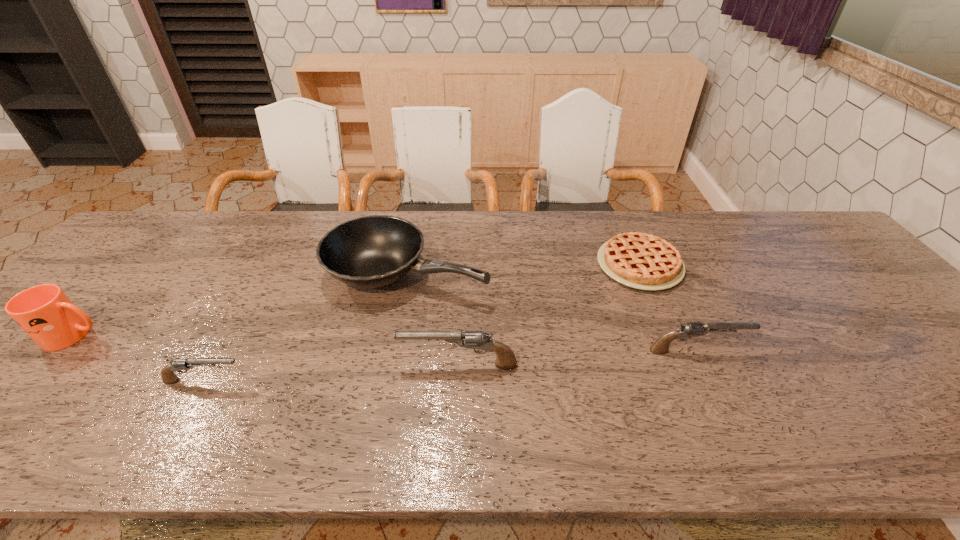
Where is `object at the left edge`? This screenshot has width=960, height=540. object at the left edge is located at coordinates (44, 312).

Where is `free region at the far edge of the desktop`? The height and width of the screenshot is (540, 960). free region at the far edge of the desktop is located at coordinates (195, 225).

Image resolution: width=960 pixels, height=540 pixels. In order to click on vacant position at the near edge of the desktop in this screenshot , I will do tap(311, 402).

I want to click on free space at the right edge of the desktop, so click(x=905, y=336).

Find the location of a particular element. This screenshot has height=540, width=960. vacant space at the far left corner of the desktop is located at coordinates (159, 238).

At what (x,y) coordinates should I click in order to perform the action: click on vacant position at the far right corner of the desktop. Please return your answer as a coordinate pair (x, y). This screenshot has height=540, width=960. Looking at the image, I should click on (782, 240).

What are the coordinates of `blank region between the leftmost gun and the pie` in the screenshot? It's located at (422, 323).

Locate an element on the screen. vacant area between the fifth tallest object and the tallest gun is located at coordinates (331, 373).

Image resolution: width=960 pixels, height=540 pixels. Identify the location of free space between the pie and the fifth object from right to left. [x=422, y=323].

Image resolution: width=960 pixels, height=540 pixels. What are the coordinates of `blank region between the second tallest gun and the leftmost object` in the screenshot? It's located at (386, 343).